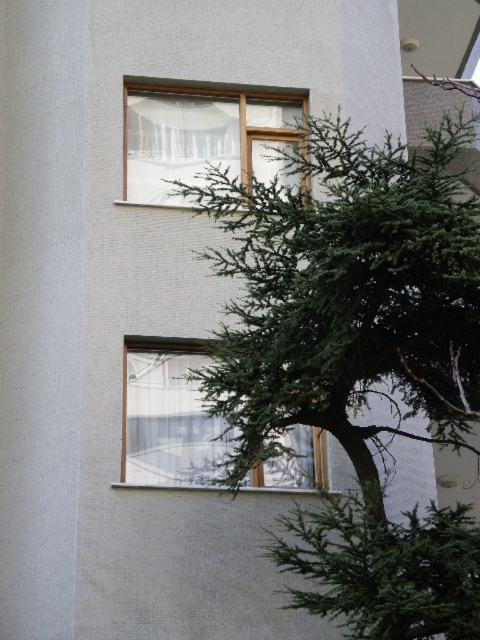
You are standing in front of a building with two windows and an evergreen tree. You want to place a flag at the point marked as point (359, 454). Considering the distance from where you are standing, will the flag be visible to someone standing 150 feet away from the building?

The point (359, 454) is 129.14 feet away from the viewer, so the flag placed there would be visible to someone standing 150 feet away since it is within that distance.

You are standing at the center of the image and want to walk towards the green leafy tree at center. In which direction should you move relative to the building?

The green leafy tree at center is located at point (356, 358), which is in the center of the image. Since you are already at the center, you don not need to move in any direction to reach it.